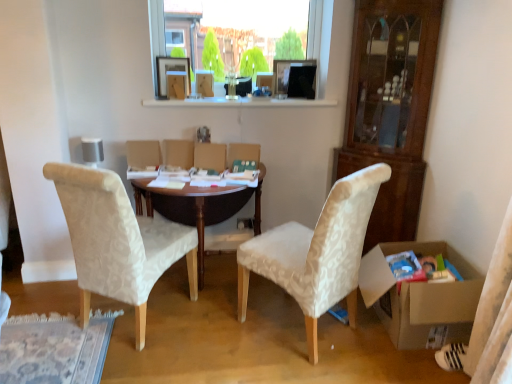
Question: Considering the positions of transparent glass window at upper center and brown wooden table at center in the image, is transparent glass window at upper center wider or thinner than brown wooden table at center?

Choices:
 (A) wide
 (B) thin

Answer: (B)

Question: From the image's perspective, is transparent glass window at upper center positioned above or below brown wooden table at center?

Choices:
 (A) above
 (B) below

Answer: (A)

Question: Which object is the closest to the patterned fabric chair at center, which is the 2th chair in left-to-right order?

Choices:
 (A) transparent glass window at upper center
 (B) brown wooden table at center
 (C) beige fabric chair at left, which is the first chair from left to right
 (D) cardboard box at lower right
 (E) wooden picture frame at upper center

Answer: (D)

Question: Which of these objects is positioned farthest from the cardboard box at lower right?

Choices:
 (A) brown wooden table at center
 (B) transparent glass window at upper center
 (C) beige fabric chair at left, which is the 2th chair from right to left
 (D) wooden picture frame at upper center
 (E) patterned fabric chair at center, the first chair viewed from the right

Answer: (D)